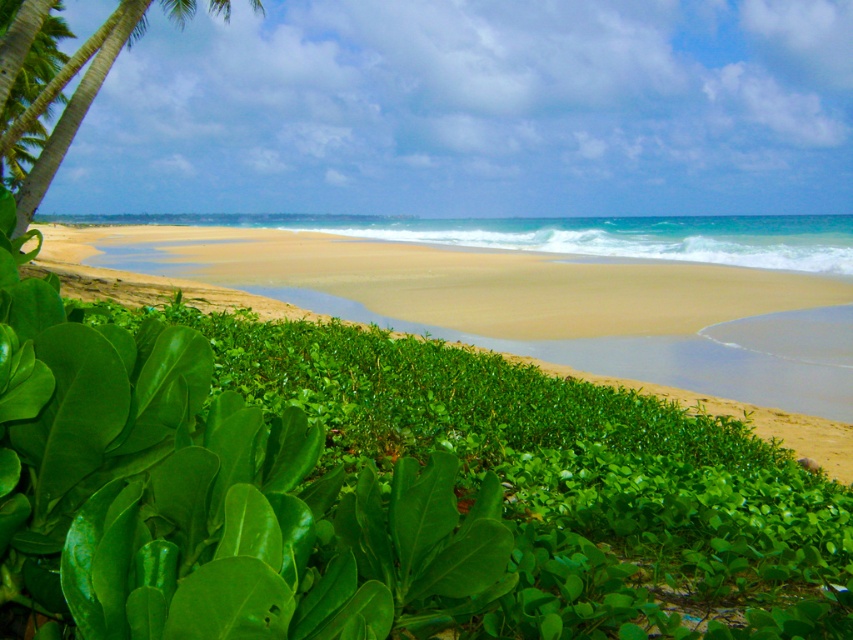
Question: Which point is closer to the camera?

Choices:
 (A) green leafy vegetation at lower left
 (B) green leafy palm tree at upper left

Answer: (B)

Question: Does green leafy vegetation at lower left appear on the right side of green leafy palm tree at upper left?

Choices:
 (A) yes
 (B) no

Answer: (B)

Question: Is green leafy vegetation at lower left thinner than green leafy palm tree at upper left?

Choices:
 (A) yes
 (B) no

Answer: (B)

Question: From the image, what is the correct spatial relationship of green leafy vegetation at lower left in relation to green leafy palm tree at upper left?

Choices:
 (A) below
 (B) above

Answer: (A)